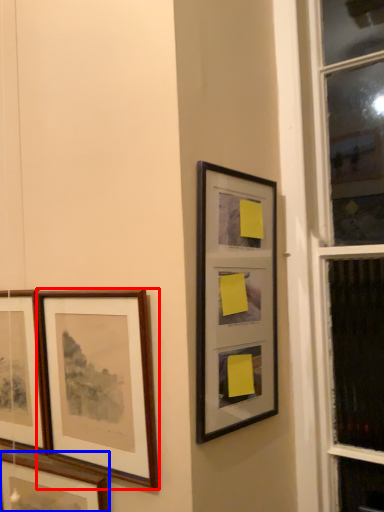
Question: Among these objects, which one is nearest to the camera, picture frame (highlighted by a red box) or picture frame (highlighted by a blue box)?

Choices:
 (A) picture frame
 (B) picture frame

Answer: (A)